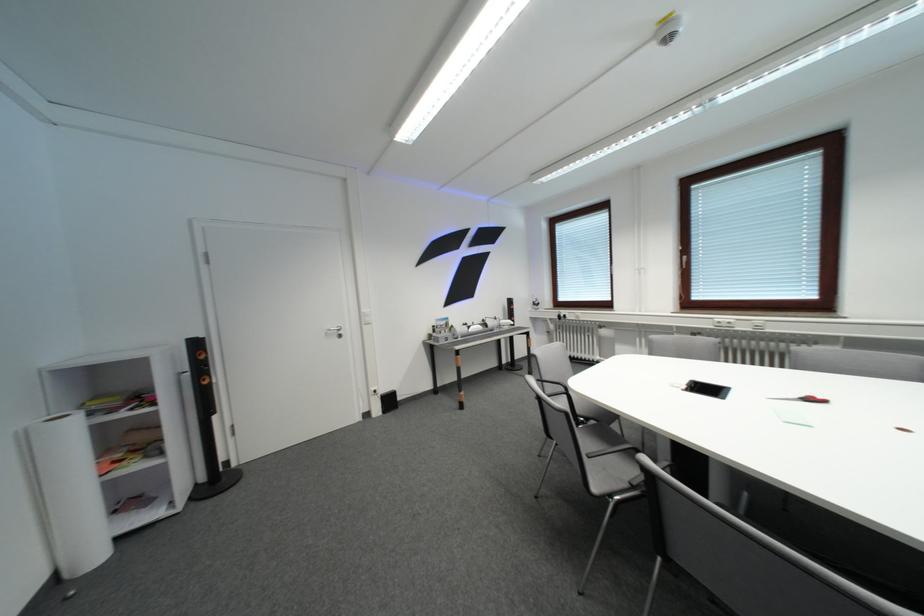
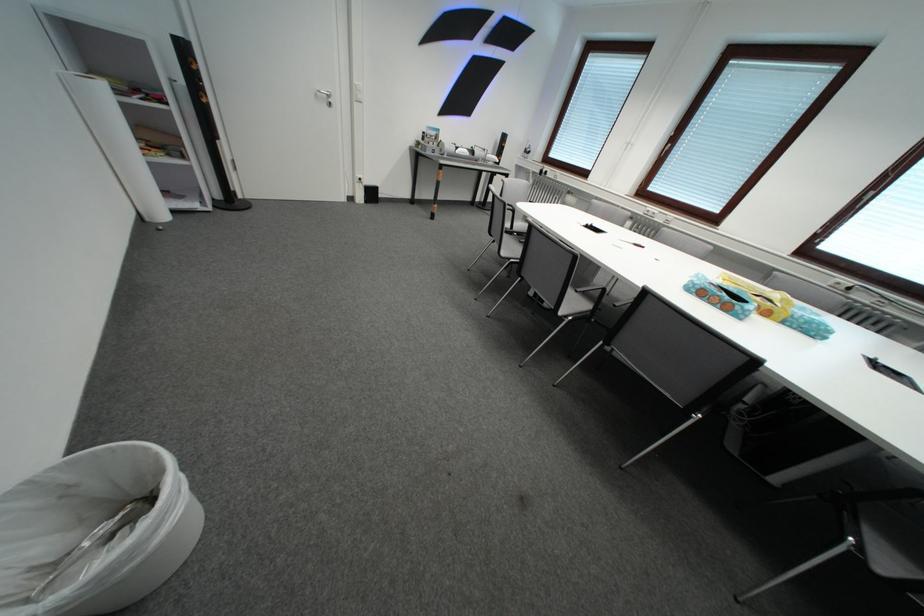
The point at (604, 492) is marked in the first image. Where is the corresponding point in the second image?

(514, 256)